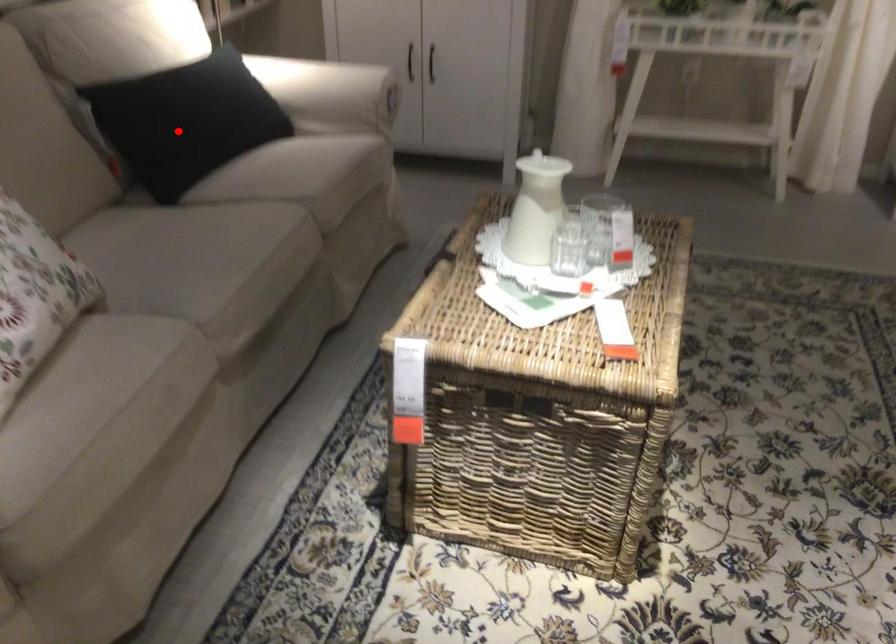
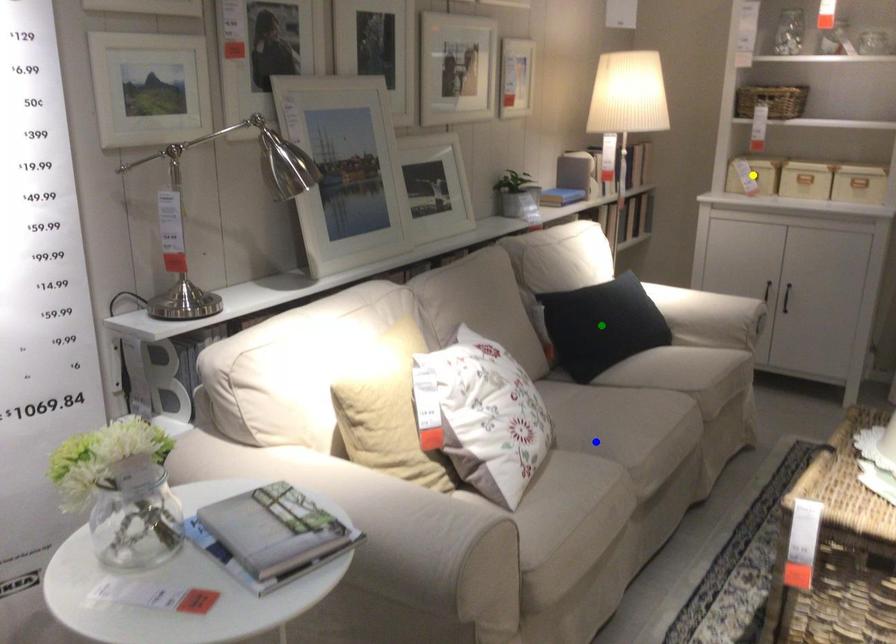
Question: I am providing you with two images of the same scene from different viewpoints. A red point is marked on the first image. You are given multiple points on the second image. Which mark in image 2 goes with the point in image 1?

Choices:
 (A) blue point
 (B) green point
 (C) yellow point

Answer: (B)